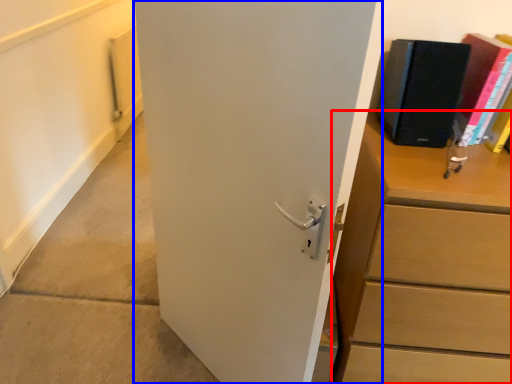
Question: Which object is further to the camera taking this photo, chest of drawers (highlighted by a red box) or door (highlighted by a blue box)?

Choices:
 (A) chest of drawers
 (B) door

Answer: (A)